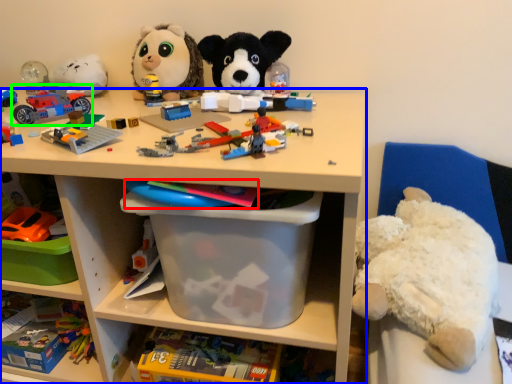
Question: Which object is the farthest from toy (highlighted by a red box)? Choose among these: shelf (highlighted by a blue box) or toy (highlighted by a green box).

Choices:
 (A) shelf
 (B) toy

Answer: (B)